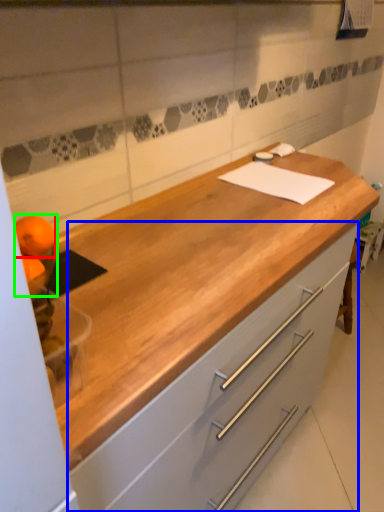
Question: Which is farther away from orange (highlighted by a red box)? cabinetry (highlighted by a blue box) or orange (highlighted by a green box)?

Choices:
 (A) cabinetry
 (B) orange

Answer: (A)